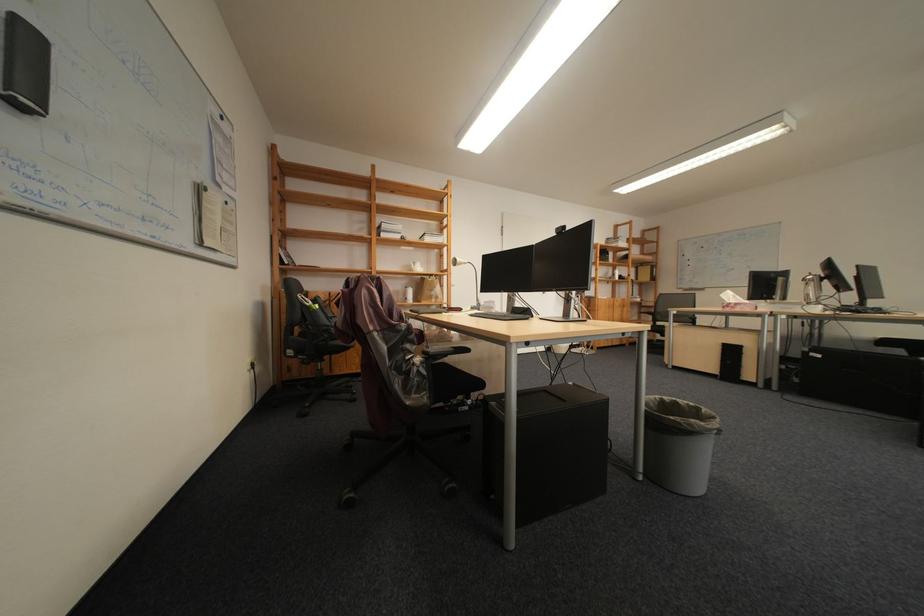
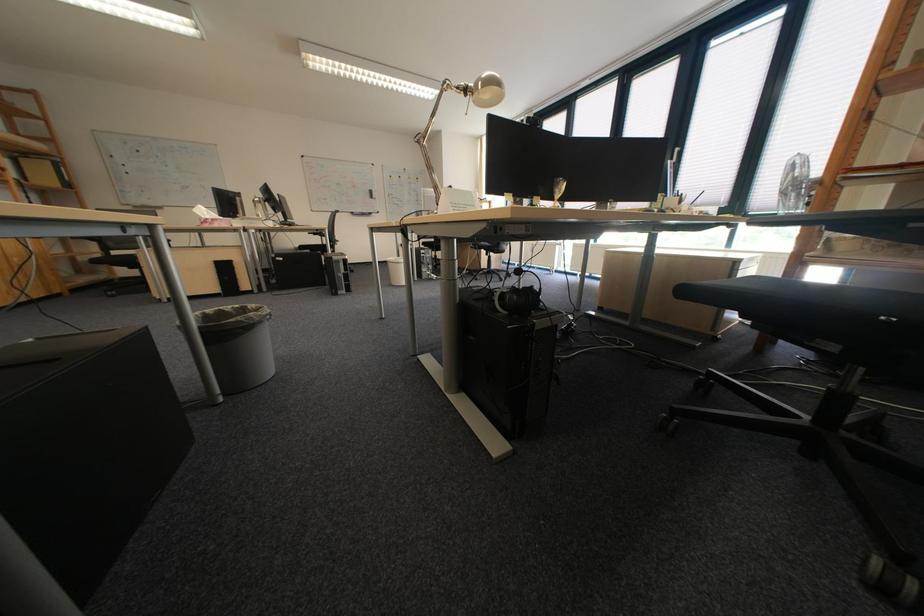
In the second image, find the point that corresponds to point (673, 398) in the first image.

(213, 314)